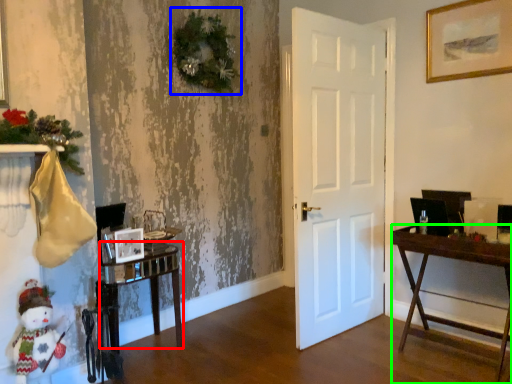
Question: Which is nearer to the table (highlighted by a red box)? christmas decoration (highlighted by a blue box) or desk (highlighted by a green box).

Choices:
 (A) christmas decoration
 (B) desk

Answer: (A)